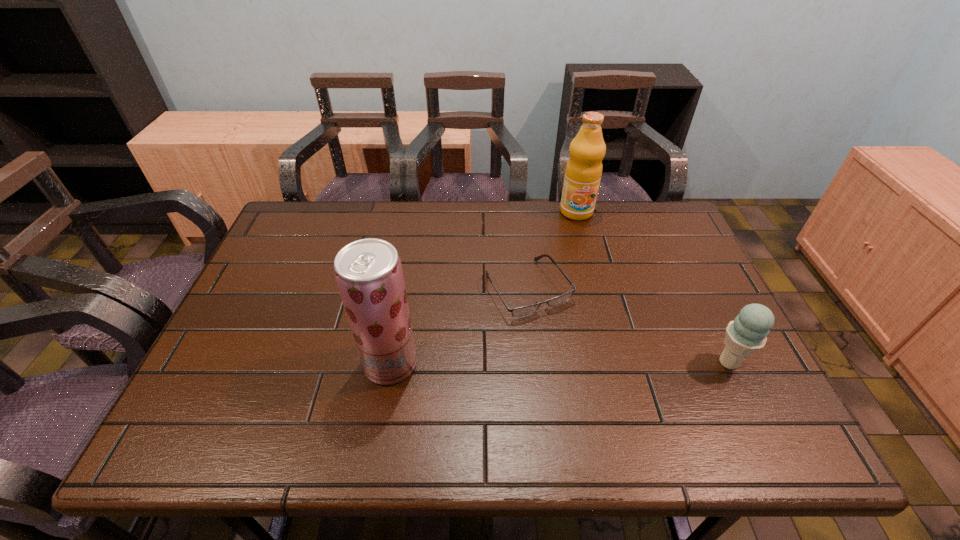
You are a GUI agent. You are given a task and a screenshot of the screen. Output one action in this format:
    pyautogui.click(x=<x>, y=<y>)
    Task: Click on the left fruit juice
    This screenshot has width=960, height=540.
    Given the screenshot: What is the action you would take?
    pyautogui.click(x=368, y=272)

Image resolution: width=960 pixels, height=540 pixels. I want to click on the nearer fruit juice, so click(x=368, y=272).

The image size is (960, 540). What are the coordinates of `the second shortest object` in the screenshot? It's located at (747, 334).

Where is `the rightmost object`? The image size is (960, 540). the rightmost object is located at coordinates pos(747,334).

You are a GUI agent. You are given a task and a screenshot of the screen. Output one action in this format:
    pyautogui.click(x=<x>, y=<y>)
    Task: Click on the farthest object
    The image size is (960, 540).
    Given the screenshot: What is the action you would take?
    pyautogui.click(x=583, y=172)

At what (x,y) coordinates should I click in order to perform the action: click on the right fruit juice. Please return your answer as a coordinate pair (x, y). This screenshot has width=960, height=540. Looking at the image, I should click on (583, 172).

What are the coordinates of `spectacles` in the screenshot? It's located at (521, 311).

You are a GUI agent. You are given a task and a screenshot of the screen. Output one action in this format:
    pyautogui.click(x=<x>, y=<y>)
    Task: Click on the second object from left to right
    The height and width of the screenshot is (540, 960).
    Given the screenshot: What is the action you would take?
    pyautogui.click(x=521, y=311)

Locate an element on the screen. This screenshot has height=540, width=960. vacant area located 0.200m on the right of the nearer fruit juice is located at coordinates (x=503, y=363).

Where is `blank space located on the back of the ice cream`? blank space located on the back of the ice cream is located at coordinates (697, 297).